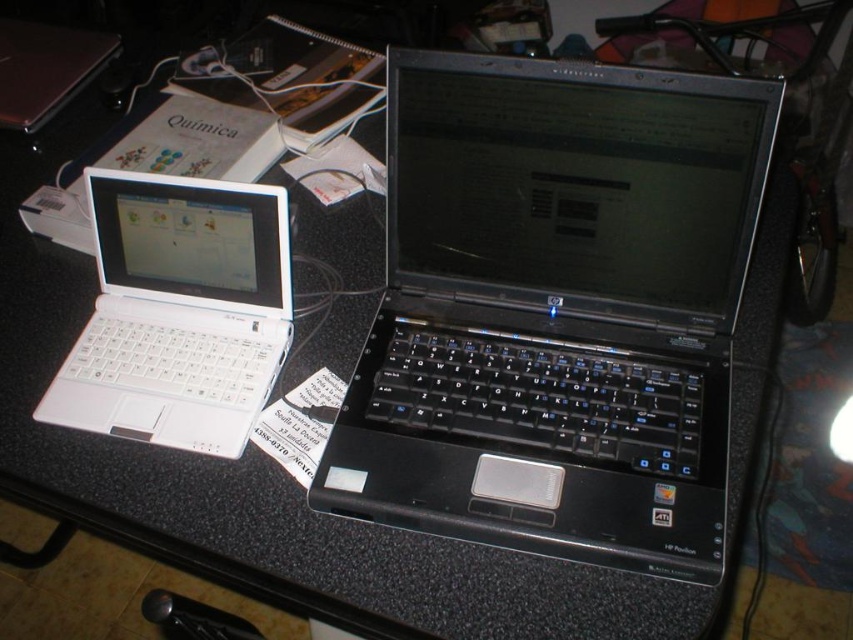
Who is higher up, white matte laptop at left or white plastic laptop at left?

Positioned higher is white plastic laptop at left.

Which is in front, point (229, 211) or point (10, 28)?

Point (229, 211) is more forward.

Measure the distance between white matte laptop at left and camera.

white matte laptop at left and camera are 28.32 inches apart from each other.

What are the coordinates of `white matte laptop at left` in the screenshot? It's located at (178, 312).

What do you see at coordinates (555, 308) in the screenshot?
I see `black plastic laptop at center` at bounding box center [555, 308].

Between black plastic laptop at center and white matte laptop at left, which one appears on the right side from the viewer's perspective?

black plastic laptop at center

Who is more forward, (426, 124) or (169, 314)?

Point (426, 124)

Locate an element on the screen. black plastic laptop at center is located at coordinates (555, 308).

Is black plastic laptop at center thinner than white plastic laptop at left?

In fact, black plastic laptop at center might be wider than white plastic laptop at left.

Between point (532, 84) and point (56, 100), which one is positioned behind?

The point (56, 100) is behind.

At what (x,y) coordinates should I click in order to perform the action: click on black plastic laptop at center. Please return your answer as a coordinate pair (x, y). The image size is (853, 640). Looking at the image, I should click on (555, 308).